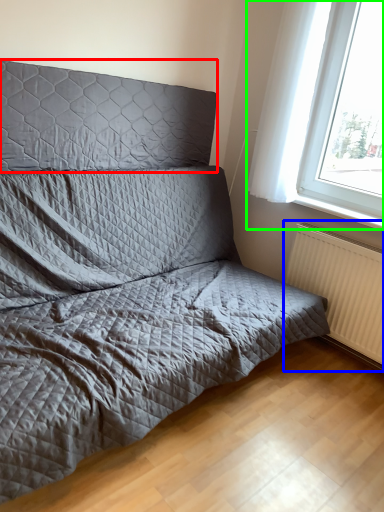
Question: Estimate the real-world distances between objects in this image. Which object is closer to headboard (highlighted by a red box), radiator (highlighted by a blue box) or window (highlighted by a green box)?

Choices:
 (A) radiator
 (B) window

Answer: (B)